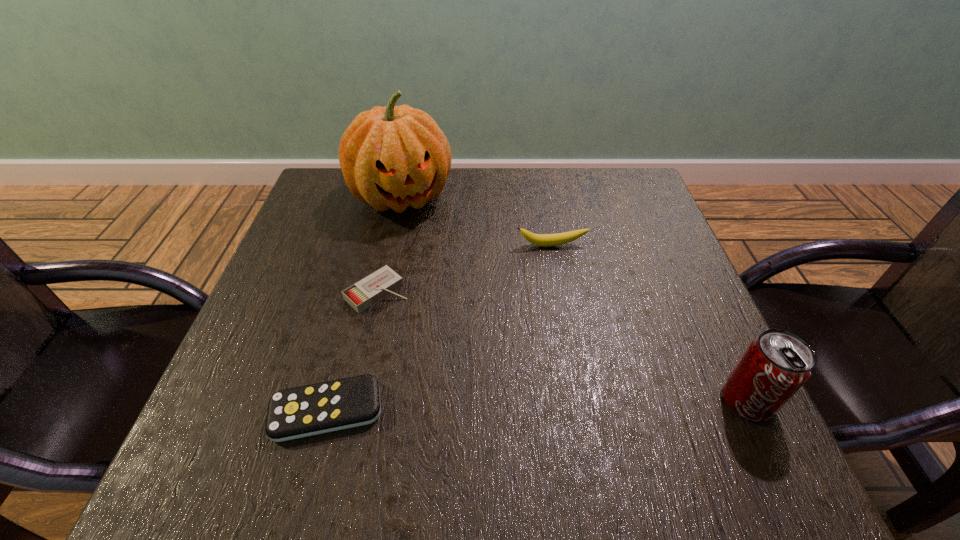
This screenshot has height=540, width=960. In order to click on object that is at the far edge in this screenshot , I will do `click(393, 157)`.

Where is `remote control present at the near edge`? remote control present at the near edge is located at coordinates coord(302,411).

Identify the location of pop soda positioned at the near edge. The width and height of the screenshot is (960, 540). (775, 365).

Where is `remote control at the left edge`? Image resolution: width=960 pixels, height=540 pixels. remote control at the left edge is located at coordinates (302, 411).

Locate an element on the screen. The image size is (960, 540). pumpkin at the left edge is located at coordinates (393, 157).

Where is `object that is at the right edge`? Image resolution: width=960 pixels, height=540 pixels. object that is at the right edge is located at coordinates (775, 365).

Locate an element on the screen. The image size is (960, 540). object that is positioned at the far left corner is located at coordinates (393, 157).

This screenshot has width=960, height=540. Identify the location of object present at the near left corner. (302, 411).

At what (x,y) coordinates should I click in order to perform the action: click on object located in the near right corner section of the desktop. Please return your answer as a coordinate pair (x, y). Looking at the image, I should click on (775, 365).

Identify the location of vacant space at the far edge of the desktop. The height and width of the screenshot is (540, 960). (381, 220).